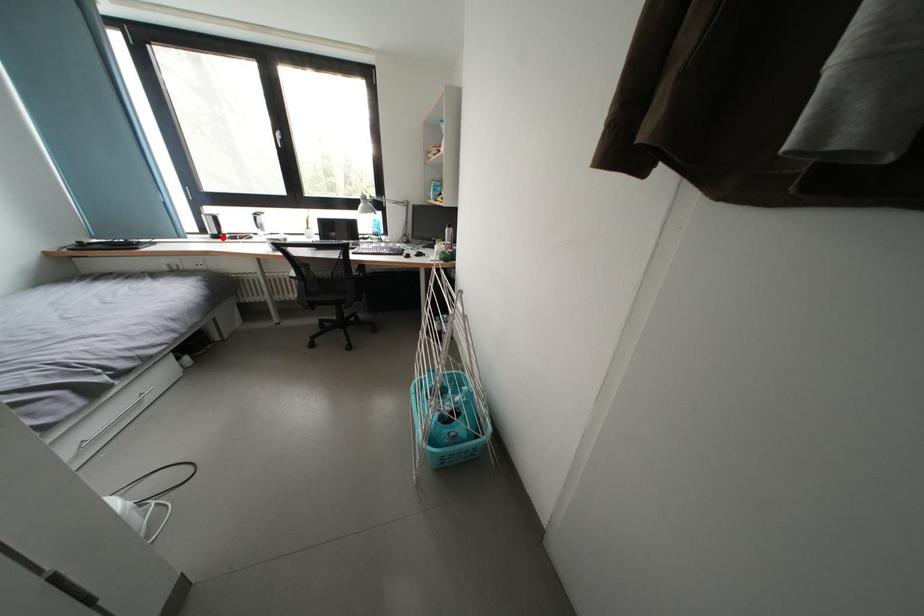
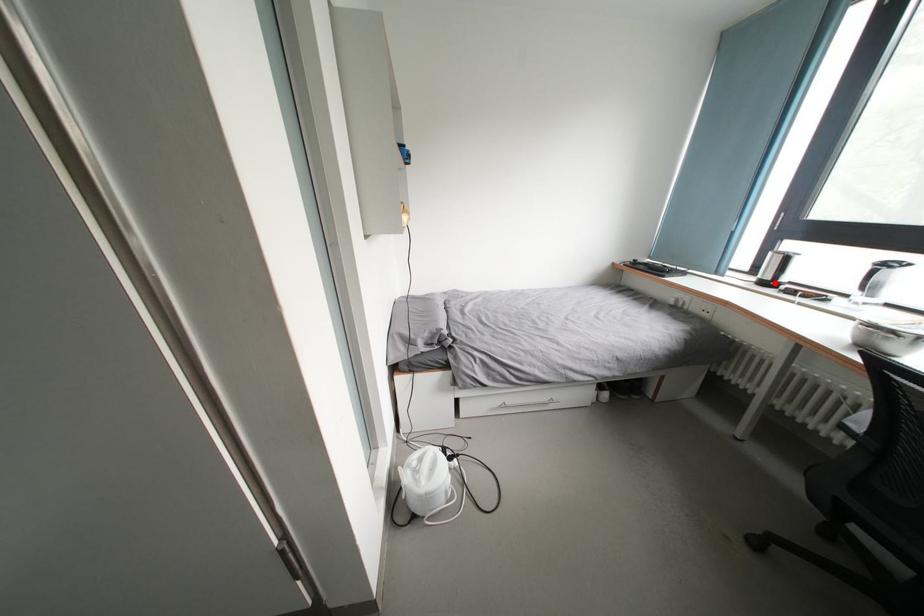
I am providing you with two images of the same scene from different viewpoints. A red point is marked on the first image and another point is marked on the second image. Does the point marked in image1 correspond to the same location as the one in image2?

Yes